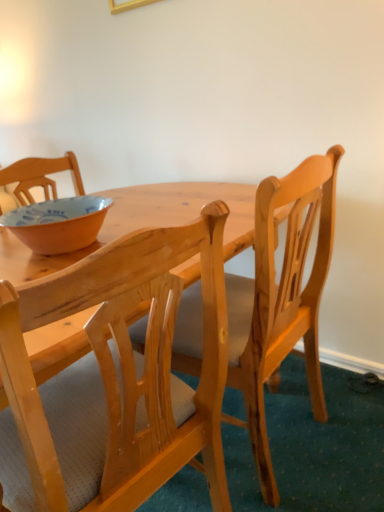
Question: Does natural wood chair at center, the second chair from the left, come behind natural wood chair at center, which is the second chair in right-to-left order?

Choices:
 (A) no
 (B) yes

Answer: (B)

Question: Is natural wood chair at center, the second chair from the left, to the left of natural wood chair at center, which is the second chair in right-to-left order, from the viewer's perspective?

Choices:
 (A) no
 (B) yes

Answer: (A)

Question: Would you say natural wood chair at center, the second chair from the left, is outside natural wood chair at center, the 1th chair in the left-to-right sequence?

Choices:
 (A) no
 (B) yes

Answer: (B)

Question: Considering the relative sizes of natural wood chair at center, the second chair from the left, and natural wood chair at center, which is the second chair in right-to-left order, in the image provided, is natural wood chair at center, the second chair from the left, wider than natural wood chair at center, which is the second chair in right-to-left order,?

Choices:
 (A) no
 (B) yes

Answer: (A)

Question: From the image's perspective, would you say natural wood chair at center, marked as the first chair in a right-to-left arrangement, is shown under natural wood chair at center, the 1th chair in the left-to-right sequence?

Choices:
 (A) no
 (B) yes

Answer: (A)

Question: Visually, is matte orange bowl at left positioned to the left or to the right of natural wood chair at center, which is the second chair in right-to-left order?

Choices:
 (A) right
 (B) left

Answer: (B)

Question: Is point (89, 201) positioned closer to the camera than point (223, 211)?

Choices:
 (A) closer
 (B) farther

Answer: (B)

Question: Looking at the image, does matte orange bowl at left seem bigger or smaller compared to natural wood chair at center, which is the second chair in right-to-left order?

Choices:
 (A) big
 (B) small

Answer: (B)

Question: From the image's perspective, relative to natural wood chair at center, which is the second chair in right-to-left order, is matte orange bowl at left above or below?

Choices:
 (A) below
 (B) above

Answer: (B)

Question: Considering their positions, is natural wood chair at center, marked as the first chair in a right-to-left arrangement, located in front of or behind matte orange bowl at left?

Choices:
 (A) behind
 (B) front

Answer: (B)

Question: Is natural wood chair at center, the second chair from the left, situated inside matte orange bowl at left or outside?

Choices:
 (A) outside
 (B) inside

Answer: (A)

Question: From a real-world perspective, relative to matte orange bowl at left, is natural wood chair at center, the second chair from the left, vertically above or below?

Choices:
 (A) below
 (B) above

Answer: (A)

Question: Considering the positions of natural wood chair at center, marked as the first chair in a right-to-left arrangement, and matte orange bowl at left in the image, is natural wood chair at center, marked as the first chair in a right-to-left arrangement, wider or thinner than matte orange bowl at left?

Choices:
 (A) wide
 (B) thin

Answer: (A)

Question: Looking at the image, does natural wood chair at center, which is the second chair in right-to-left order, seem bigger or smaller compared to matte orange bowl at left?

Choices:
 (A) big
 (B) small

Answer: (A)

Question: Considering the positions of natural wood chair at center, which is the second chair in right-to-left order, and matte orange bowl at left in the image, is natural wood chair at center, which is the second chair in right-to-left order, taller or shorter than matte orange bowl at left?

Choices:
 (A) tall
 (B) short

Answer: (A)